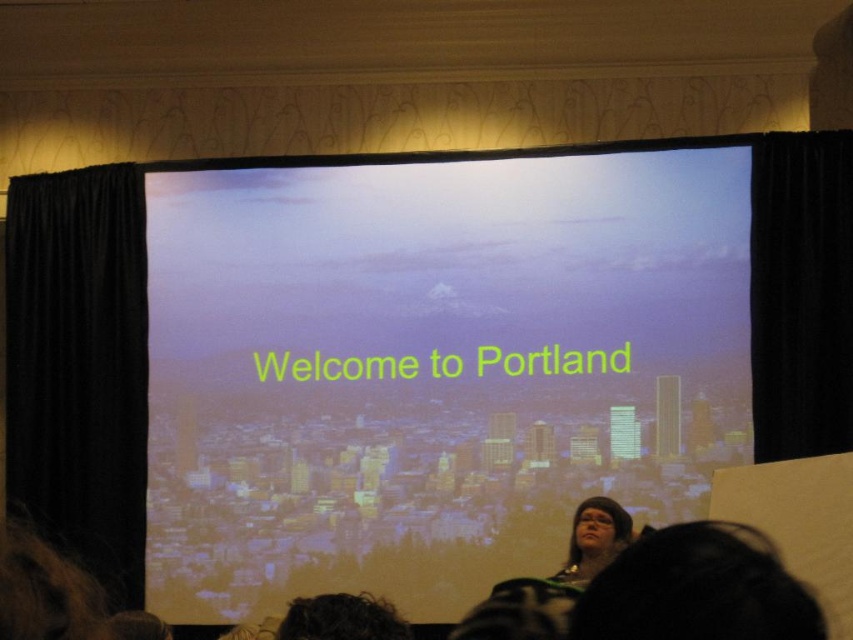
Is point (45, 176) less distant than point (404, 628)?

No, it is not.

Where is `black velvet curtain at left`? This screenshot has width=853, height=640. black velvet curtain at left is located at coordinates (79, 365).

Is black velvet curtain at right to the left of black hair at lower right from the viewer's perspective?

No, black velvet curtain at right is not to the left of black hair at lower right.

Between point (828, 291) and point (695, 552), which one is positioned in front?

Point (695, 552)

I want to click on black velvet curtain at right, so click(801, 292).

Can you confirm if matte screen at center is positioned above dark curly hair at lower center?

Indeed, matte screen at center is positioned over dark curly hair at lower center.

Between point (149, 298) and point (347, 611), which one is positioned in front?

Point (347, 611) is in front.

Which is in front, point (196, 266) or point (352, 625)?

Point (352, 625) is more forward.

At what (x,y) coordinates should I click in order to perform the action: click on matte screen at center. Please return your answer as a coordinate pair (x, y). Image resolution: width=853 pixels, height=640 pixels. Looking at the image, I should click on (433, 365).